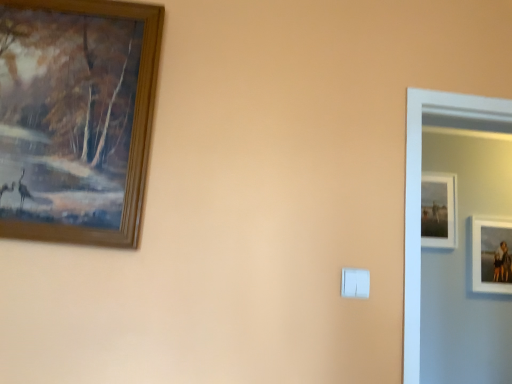
Question: Visually, is white plastic light switch at center positioned to the left or to the right of wooden picture frame at upper left, acting as the 3th picture frame starting from the right?

Choices:
 (A) left
 (B) right

Answer: (B)

Question: Is white plastic light switch at center in front of or behind wooden picture frame at upper left, the first picture frame positioned from the left, in the image?

Choices:
 (A) behind
 (B) front

Answer: (A)

Question: Estimate the real-world distances between objects in this image. Which object is closer to the white plastic light switch at center?

Choices:
 (A) white matte picture frame at right, the 2th picture frame when ordered from front to back
 (B) matte white picture frame at upper right, arranged as the 2th picture frame when viewed from the right
 (C) wooden picture frame at upper left, acting as the 3th picture frame starting from the right

Answer: (C)

Question: Considering the real-world distances, which object is closest to the white matte picture frame at right, the second picture frame positioned from the back?

Choices:
 (A) wooden picture frame at upper left, the first picture frame positioned from the left
 (B) white plastic light switch at center
 (C) matte white picture frame at upper right, the third picture frame when ordered from front to back

Answer: (C)